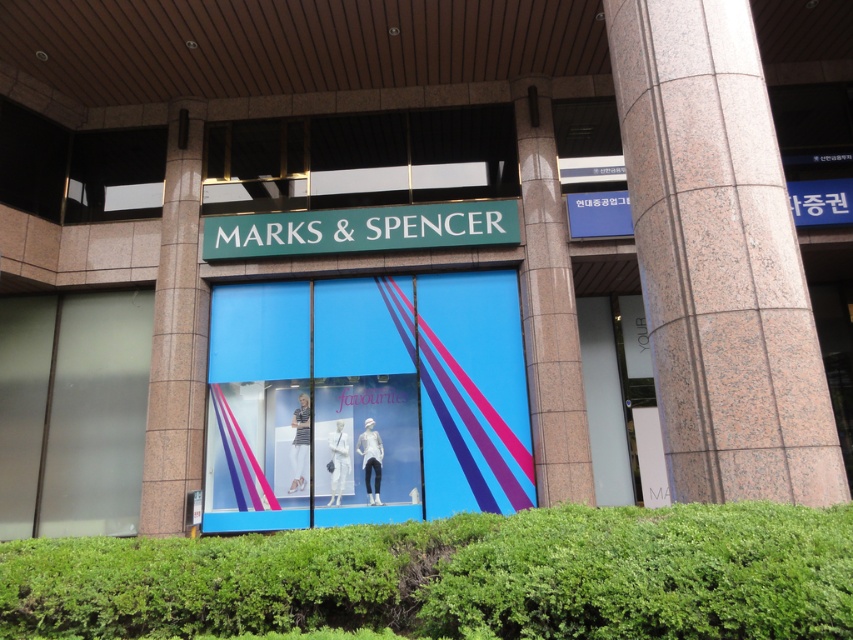
You are standing in front of the Marks and Spencer store and see the green leafy hedge at lower center and the granite column at right. Which object is positioned to the left of the other?

The green leafy hedge at lower center is to the left of the granite column at right.

You are standing in front of the Marks and Spencer store and want to take a photo of the green leafy hedge at lower center and the granite column at right. Which object is closer to you so it will appear larger in the photo?

The green leafy hedge at lower center is closer to the viewer than the granite column at right, so it will appear larger in the photo.

You are standing in front of the Marks and Spencer store and notice a point marked at coordinates (457, 577). What object is located at this point?

The point at coordinates (457, 577) corresponds to the green leafy hedge at lower center.